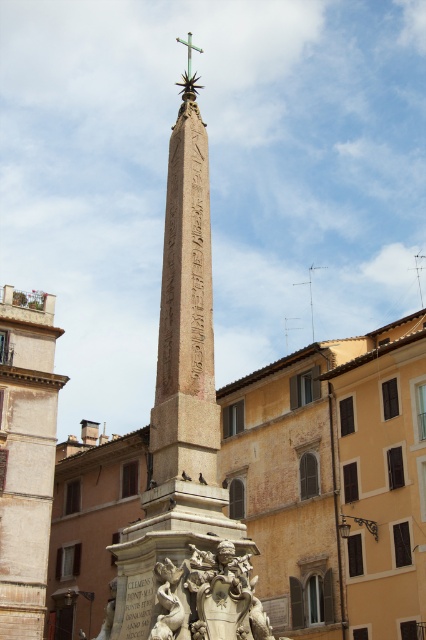
Question: Is beige stone obelisk at center further to camera compared to polished stone sculpture at center?

Choices:
 (A) no
 (B) yes

Answer: (A)

Question: Which of the following is the closest to the observer?

Choices:
 (A) (167, 588)
 (B) (242, 579)
 (C) (11, 480)
 (D) (198, 48)

Answer: (A)

Question: Does beige stone obelisk at center come behind light brown stone tower at left?

Choices:
 (A) yes
 (B) no

Answer: (B)

Question: Which point is farther to the camera?

Choices:
 (A) polished bronze sculpture at lower center
 (B) polished stone sculpture at center
 (C) green metallic cross at upper center

Answer: (C)

Question: Can you confirm if beige stone obelisk at center is positioned to the left of green metallic cross at upper center?

Choices:
 (A) yes
 (B) no

Answer: (B)

Question: Estimate the real-world distances between objects in this image. Which object is farther from the polished stone sculpture at center?

Choices:
 (A) beige stone obelisk at center
 (B) light brown stone tower at left
 (C) polished bronze sculpture at lower center
 (D) green metallic cross at upper center

Answer: (D)